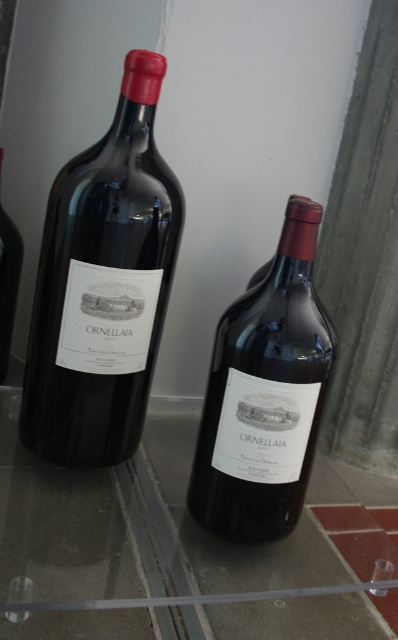
Between point (271, 288) and point (0, 227), which one is positioned behind?

The point (0, 227) is more distant.

Does matte glass bottle at center have a larger size compared to matte glass bottle at left?

Correct, matte glass bottle at center is larger in size than matte glass bottle at left.

Find the location of a particular element. matte glass bottle at center is located at coordinates (265, 394).

Can you confirm if transparent glass table at center is positioned to the left of matte glass bottle at left?

In fact, transparent glass table at center is to the right of matte glass bottle at left.

Does transparent glass table at center appear over matte glass bottle at left?

Incorrect, transparent glass table at center is not positioned above matte glass bottle at left.

Is point (154, 497) positioned after point (5, 241)?

That is False.

Identify the location of transparent glass table at center. (152, 525).

Between point (66, 544) and point (146, 125), which one is positioned in front?

Point (66, 544) is in front.

Does point (117, 552) lie in front of point (144, 307)?

That is True.

The width and height of the screenshot is (398, 640). In order to click on transparent glass table at center in this screenshot , I will do `click(152, 525)`.